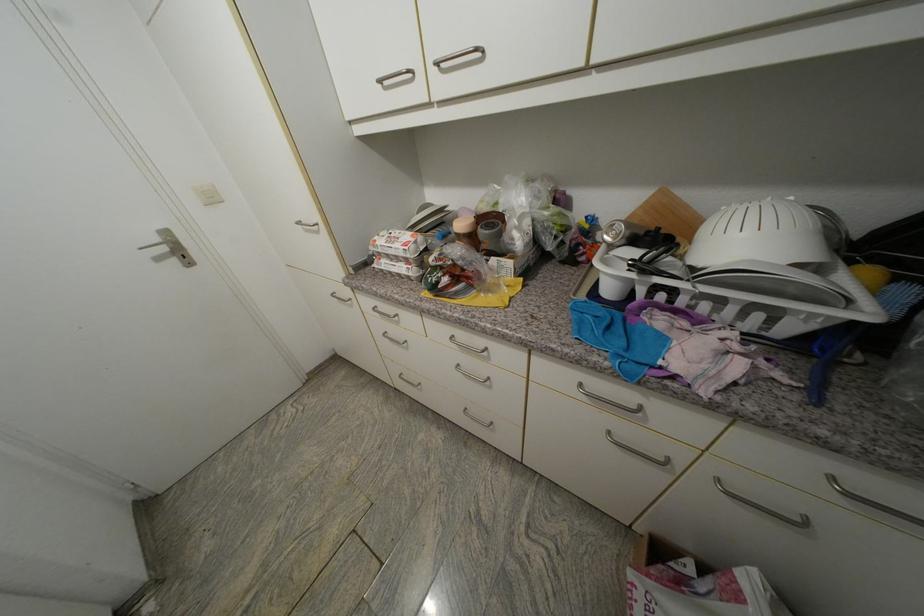
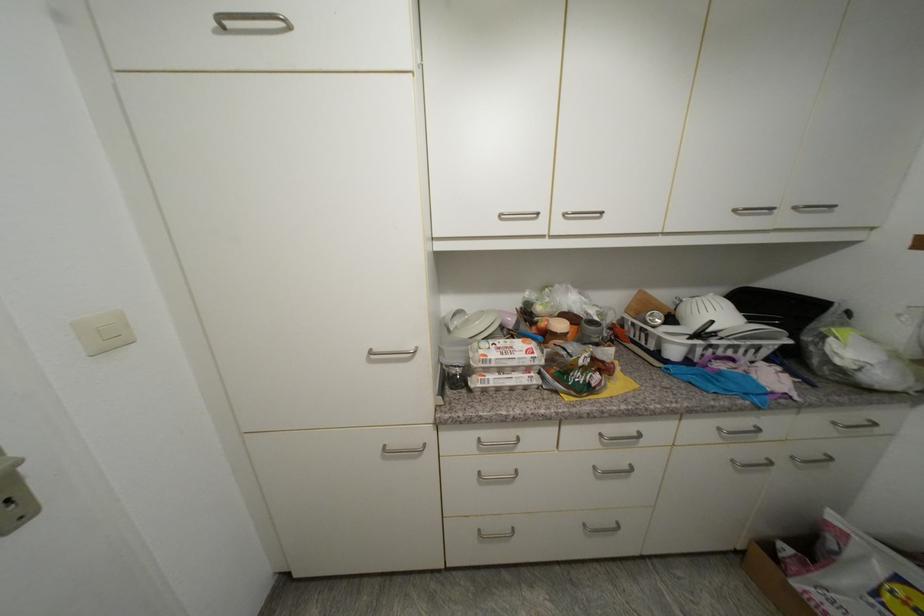
Find the pixel in the second image that matches point 444,67 in the first image.

(570, 216)